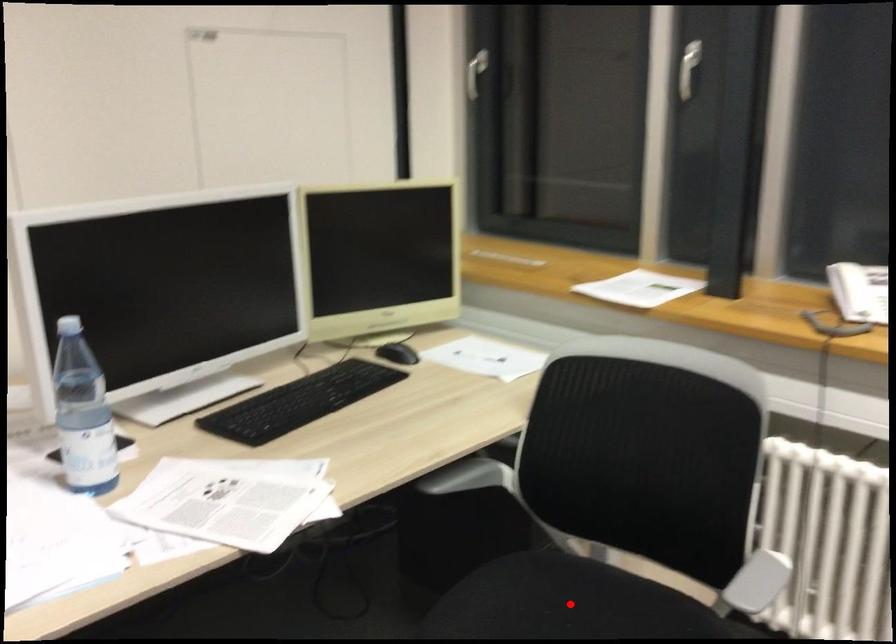
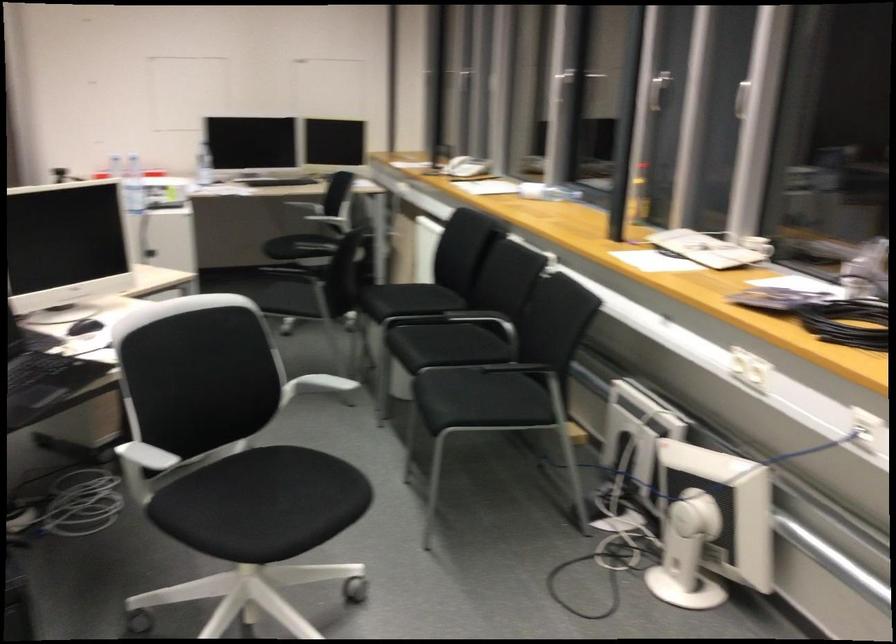
The point at the highlighted location is marked in the first image. Where is the corresponding point in the second image?

(319, 236)